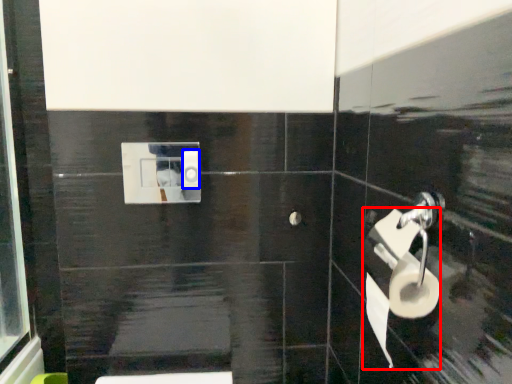
Question: Which of the following is the closest to the observer, toilet paper (highlighted by a red box) or toilet paper (highlighted by a blue box)?

Choices:
 (A) toilet paper
 (B) toilet paper

Answer: (A)